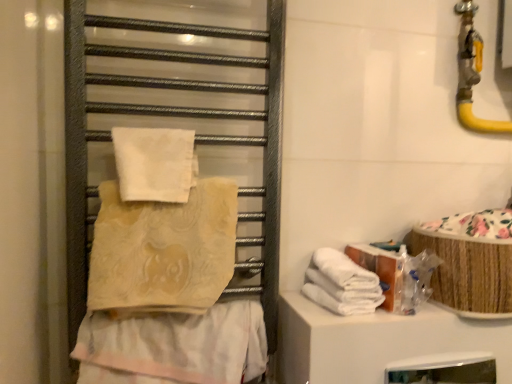
Question: In terms of size, does metallic towel rack at left appear bigger or smaller than beige textured towel at center, the fourth towel positioned from the top?

Choices:
 (A) big
 (B) small

Answer: (A)

Question: From a real-world perspective, is metallic towel rack at left physically located above or below beige textured towel at center, the fourth towel positioned from the top?

Choices:
 (A) above
 (B) below

Answer: (A)

Question: Which is farther from the beige textured towel at center, positioned as the second towel in top-to-bottom order?

Choices:
 (A) white soft towels at lower right, acting as the third towel starting from the top
 (B) white soft towel at upper center, which is the first towel in top-to-bottom order
 (C) beige textured towel at center, arranged as the 1th towel when ordered from the bottom
 (D) metallic towel rack at left
 (E) woven bamboo basket at right

Answer: (E)

Question: Based on their relative distances, which object is nearer to the white soft towel at upper center, which is the first towel in top-to-bottom order?

Choices:
 (A) metallic towel rack at left
 (B) beige textured towel at center, positioned as the second towel in top-to-bottom order
 (C) woven bamboo basket at right
 (D) white soft towels at lower right, acting as the third towel starting from the top
 (E) beige textured towel at center, the fourth towel positioned from the top

Answer: (B)